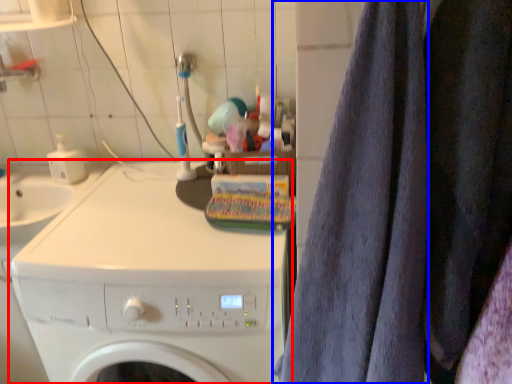
Question: Which object appears closest to the camera in this image, washing machine (highlighted by a red box) or bath towel (highlighted by a blue box)?

Choices:
 (A) washing machine
 (B) bath towel

Answer: (B)